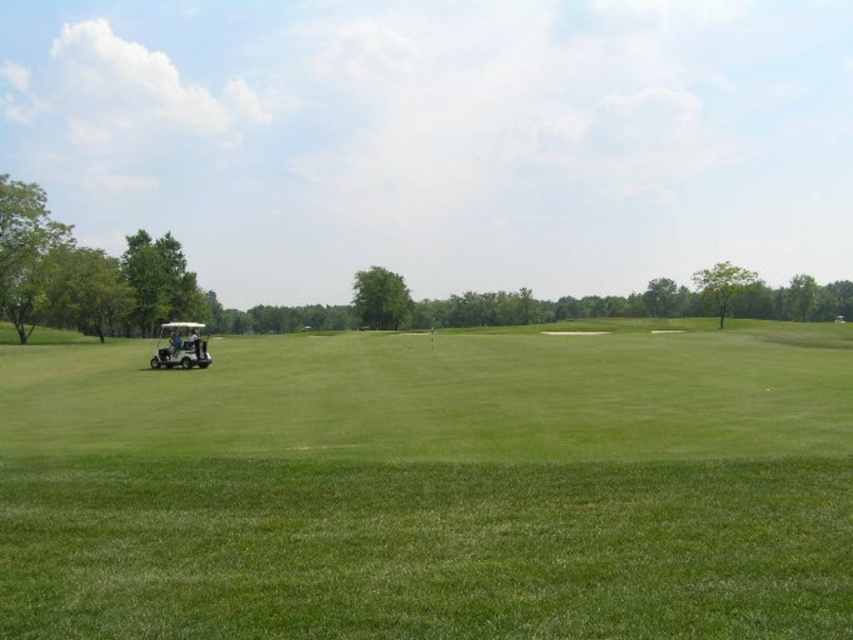
Which is more to the left, green smooth grass at center or white matte golf cart at left?

white matte golf cart at left is more to the left.

Which is in front, point (741, 620) or point (202, 349)?

Positioned in front is point (741, 620).

The width and height of the screenshot is (853, 640). I want to click on green smooth grass at center, so click(x=432, y=486).